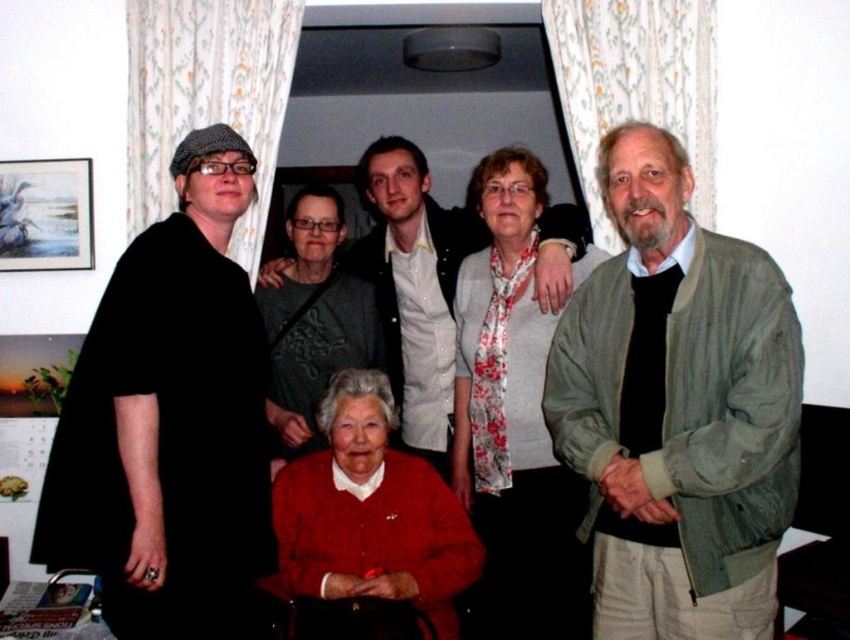
You are organizing a charity clothing drive and need to determine which items are suitable for donation. Based on the image, which object between the light brown leather jacket at center and the dark gray fabric at upper center is more likely to be donated due to its size?

The light brown leather jacket at center has a larger size compared to the dark gray fabric at upper center, so it is more likely to be donated due to its size.

In the scene shown: You are a photographer setting up for a group photo in this living room. You need to ensure that the light brown leather jacket at center is visible above the dark gray fabric at upper center. Based on their heights, will the jacket be visible over the fabric?

The light brown leather jacket at center is taller than the dark gray fabric at upper center, so yes, the jacket will be visible above the fabric.